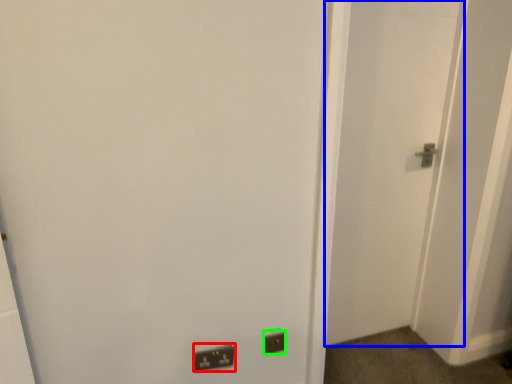
Question: Which is nearer to the light switch (highlighted by a red box)? door (highlighted by a blue box) or electric outlet (highlighted by a green box).

Choices:
 (A) door
 (B) electric outlet

Answer: (B)